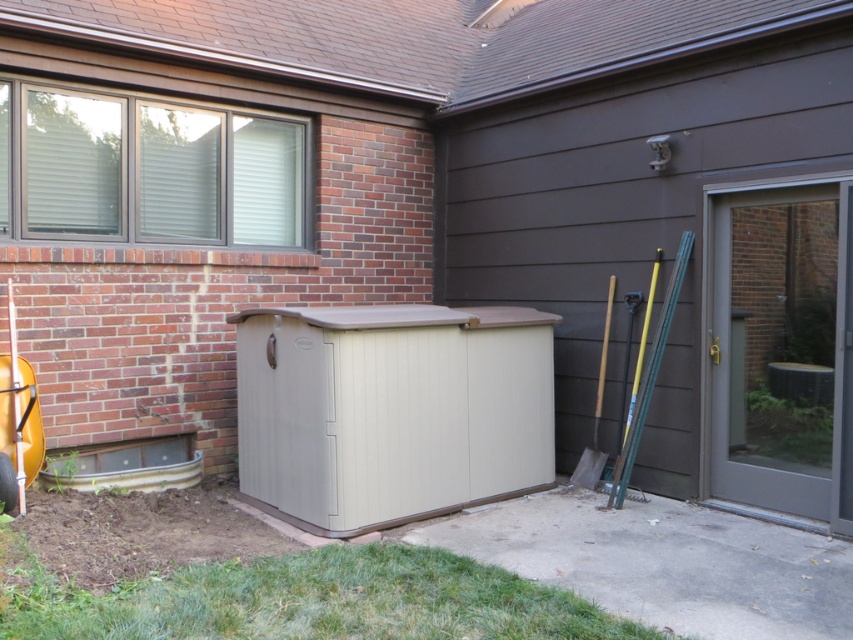
Question: Among these points, which one is nearest to the camera?

Choices:
 (A) (612, 300)
 (B) (811, 509)

Answer: (B)

Question: Can you confirm if matte gray screen door at right is wider than wooden shovel at right?

Choices:
 (A) no
 (B) yes

Answer: (B)

Question: Where is matte gray screen door at right located in relation to wooden shovel at right in the image?

Choices:
 (A) below
 (B) above

Answer: (B)

Question: Is matte gray screen door at right to the left of wooden shovel at right from the viewer's perspective?

Choices:
 (A) no
 (B) yes

Answer: (A)

Question: Among these objects, which one is farthest from the camera?

Choices:
 (A) wooden shovel at right
 (B) matte gray screen door at right

Answer: (A)